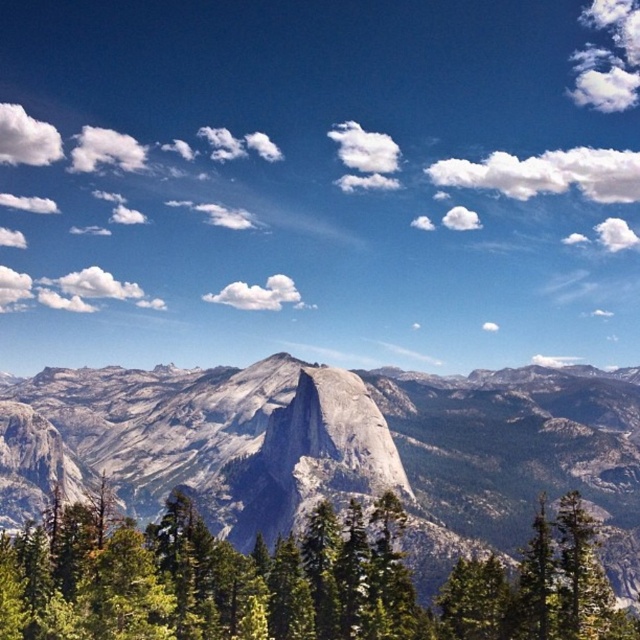
Question: Which of the following is the closest to the observer?

Choices:
 (A) green matte tree at lower right
 (B) granite mountain range at center

Answer: (A)

Question: Is granite mountain range at center closer to the viewer compared to green textured tree at center?

Choices:
 (A) yes
 (B) no

Answer: (B)

Question: Does green textured tree at center appear on the right side of green matte tree at lower right?

Choices:
 (A) yes
 (B) no

Answer: (B)

Question: Observing the image, what is the correct spatial positioning of green textured tree at center in reference to green matte tree at lower right?

Choices:
 (A) above
 (B) below

Answer: (B)

Question: Among these points, which one is nearest to the camera?

Choices:
 (A) (528, 531)
 (B) (524, 557)
 (C) (168, 513)

Answer: (C)

Question: Which object is positioned farthest from the green matte tree at lower right?

Choices:
 (A) granite mountain range at center
 (B) green textured tree at center

Answer: (A)